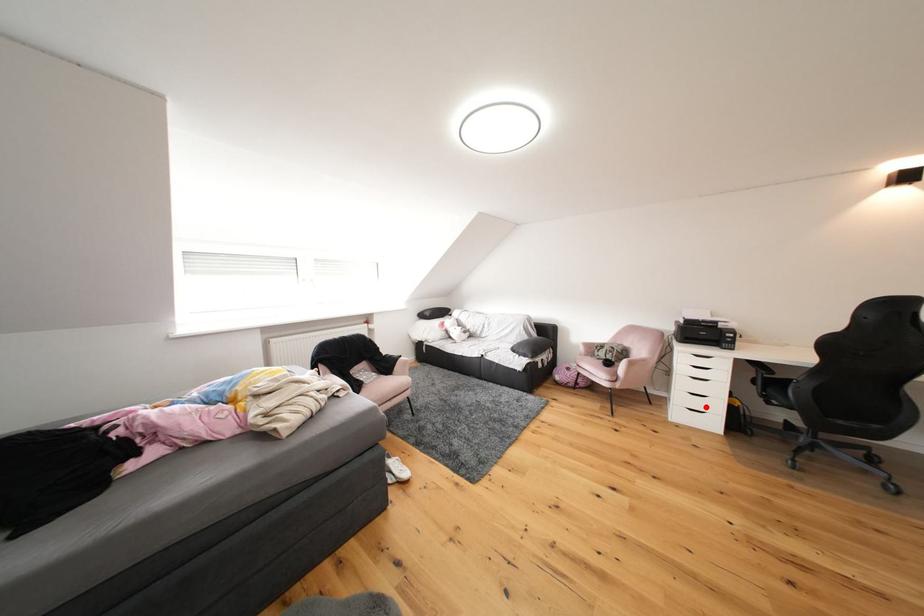
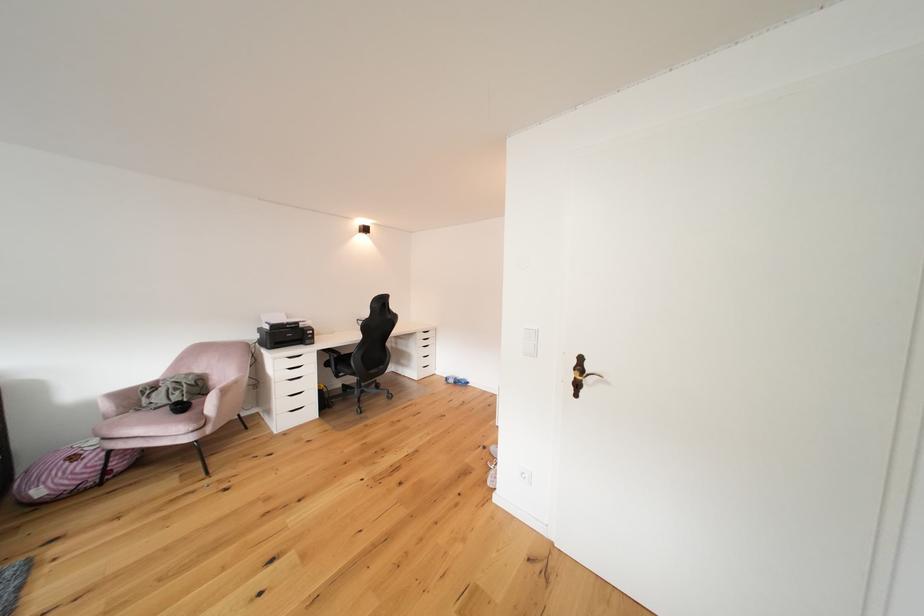
Where in the second image is the point corresponding to the highlighted location from the first image?

(306, 406)